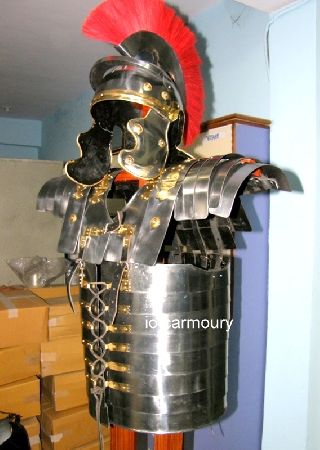
Where is `utility cable painted same color as wall`? The width and height of the screenshot is (320, 450). utility cable painted same color as wall is located at coordinates (268, 24).